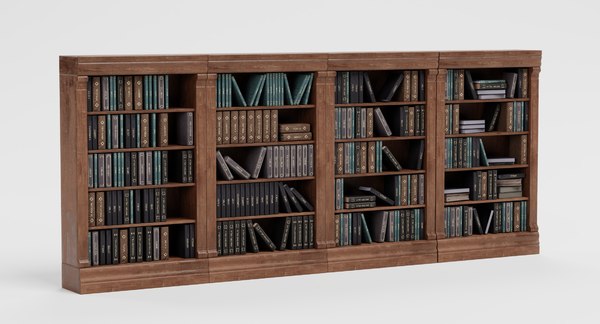
Identify the location of bottom of book shelf. The width and height of the screenshot is (600, 324). (131, 274), (244, 267), (396, 254), (477, 247).